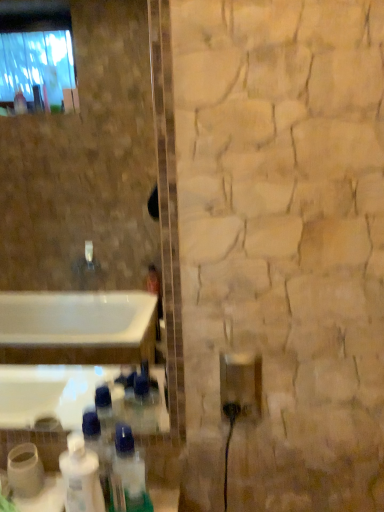
Question: Should I look upward or downward to see white glossy bottle at lower left?

Choices:
 (A) down
 (B) up

Answer: (A)

Question: Is white glossy bottle at lower left, which is counted as the 1th bottle, starting from the left, bigger than white glossy bottle at lower left?

Choices:
 (A) yes
 (B) no

Answer: (B)

Question: From a real-world perspective, is white glossy bottle at lower left, which appears as the second bottle when viewed from the right, physically below white glossy bottle at lower left?

Choices:
 (A) no
 (B) yes

Answer: (A)

Question: Is white glossy bottle at lower left, which is counted as the 1th bottle, starting from the left, directly adjacent to white glossy bottle at lower left?

Choices:
 (A) no
 (B) yes

Answer: (B)

Question: Is white glossy bottle at lower left, which appears as the second bottle when viewed from the right, to the right of white glossy bottle at lower left from the viewer's perspective?

Choices:
 (A) yes
 (B) no

Answer: (B)

Question: Considering the relative positions of white glossy bottle at lower left, which appears as the second bottle when viewed from the right, and white glossy bottle at lower left in the image provided, is white glossy bottle at lower left, which appears as the second bottle when viewed from the right, behind white glossy bottle at lower left?

Choices:
 (A) yes
 (B) no

Answer: (A)

Question: From the image's perspective, is white glossy bottle at lower left, which is counted as the 1th bottle, starting from the left, located beneath white glossy bottle at lower left?

Choices:
 (A) no
 (B) yes

Answer: (A)

Question: Is the surface of clear plastic bottle at lower center, which ranks as the first bottle in right-to-left order, in direct contact with white glossy bottle at lower left, which is counted as the 1th bottle, starting from the left?

Choices:
 (A) yes
 (B) no

Answer: (A)

Question: Considering the relative positions of clear plastic bottle at lower center, which ranks as the first bottle in right-to-left order, and white glossy bottle at lower left, which is counted as the 1th bottle, starting from the left, in the image provided, is clear plastic bottle at lower center, which ranks as the first bottle in right-to-left order, in front of white glossy bottle at lower left, which is counted as the 1th bottle, starting from the left,?

Choices:
 (A) yes
 (B) no

Answer: (A)

Question: Is white glossy bottle at lower left, which is counted as the 1th bottle, starting from the left, at the back of clear plastic bottle at lower center, which ranks as the first bottle in right-to-left order?

Choices:
 (A) no
 (B) yes

Answer: (A)

Question: Considering the relative positions of clear plastic bottle at lower center, the 2th bottle viewed from the left, and white glossy bottle at lower left, which appears as the second bottle when viewed from the right, in the image provided, is clear plastic bottle at lower center, the 2th bottle viewed from the left, to the right of white glossy bottle at lower left, which appears as the second bottle when viewed from the right, from the viewer's perspective?

Choices:
 (A) yes
 (B) no

Answer: (A)

Question: Would you say clear plastic bottle at lower center, which ranks as the first bottle in right-to-left order, is outside white glossy bottle at lower left, which appears as the second bottle when viewed from the right?

Choices:
 (A) yes
 (B) no

Answer: (A)

Question: Does clear plastic bottle at lower center, which ranks as the first bottle in right-to-left order, have a greater height compared to white glossy bottle at lower left, which is counted as the 1th bottle, starting from the left?

Choices:
 (A) yes
 (B) no

Answer: (B)

Question: Is clear plastic bottle at lower center, which ranks as the first bottle in right-to-left order, at the back of white glossy bottle at lower left?

Choices:
 (A) no
 (B) yes

Answer: (A)